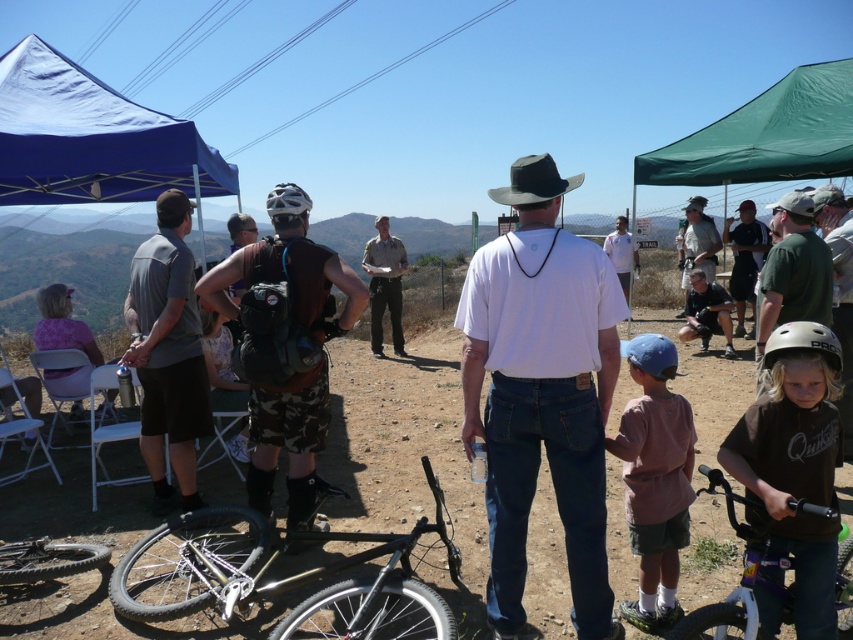
Question: Which object is the farthest from the light brown uniform at center?

Choices:
 (A) blue matte helmet at center
 (B) matte black helmet at lower right
 (C) black leather cowboy hat at center
 (D) green fabric shirt at right

Answer: (B)

Question: Is dirt field at center closer to the viewer compared to black matte mountain bike at center?

Choices:
 (A) no
 (B) yes

Answer: (A)

Question: Is light brown uniform at center wider than blue matte helmet at center?

Choices:
 (A) yes
 (B) no

Answer: (A)

Question: Which point appears closest to the camera in this image?

Choices:
 (A) (741, 221)
 (B) (306, 209)

Answer: (B)

Question: Which object is farther from the camera taking this photo?

Choices:
 (A) pink cotton shirt at center
 (B) white matte bicycle at lower right

Answer: (A)

Question: Is light brown uniform at center positioned at the back of white matte shirt at center?

Choices:
 (A) no
 (B) yes

Answer: (A)